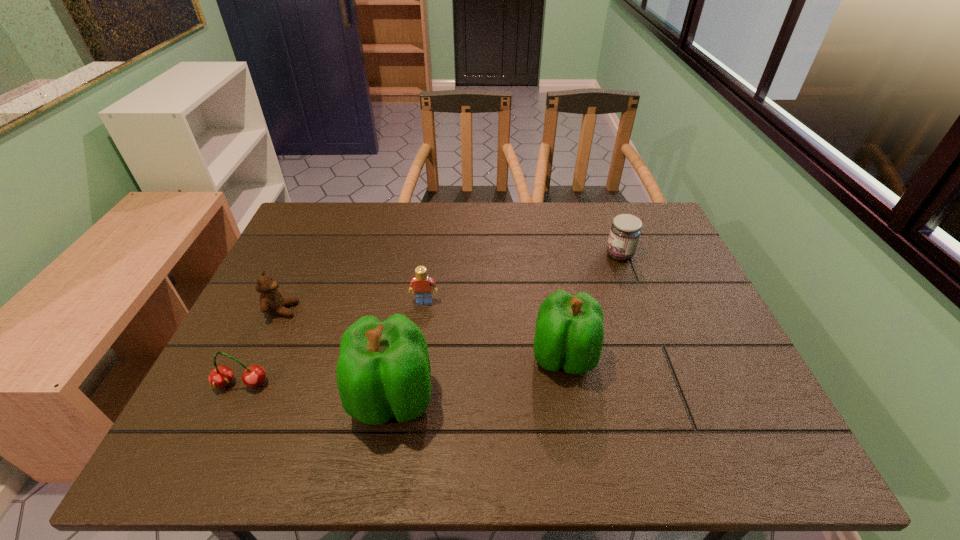
At what (x,y) coordinates should I click in order to perform the action: click on vacant space situated 0.170m on the right of the fifth shortest object. Please return your answer as a coordinate pair (x, y). This screenshot has width=960, height=540. Looking at the image, I should click on (669, 357).

I want to click on vacant area located 0.320m on the front label of the jam, so click(x=497, y=255).

Find the location of a particular element. vacant space located on the front label of the jam is located at coordinates (497, 255).

Where is `vacant space situated 0.220m on the front label of the jam`? Image resolution: width=960 pixels, height=540 pixels. vacant space situated 0.220m on the front label of the jam is located at coordinates coord(531,255).

You are a GUI agent. You are given a task and a screenshot of the screen. Output one action in this format:
    pyautogui.click(x=<x>, y=<y>)
    Task: Click on the vacant space located 0.180m at the face of the teddy bear
    
    Given the screenshot: What is the action you would take?
    pyautogui.click(x=367, y=310)

This screenshot has height=540, width=960. I want to click on vacant region located 0.250m on the front-facing side of the Lego, so (x=414, y=387).

This screenshot has height=540, width=960. What are the coordinates of `object present at the far edge` in the screenshot? It's located at (625, 231).

You are a GUI agent. You are given a task and a screenshot of the screen. Output one action in this format:
    pyautogui.click(x=<x>, y=<y>)
    Task: Click on the cherry that is at the near edge
    The width and height of the screenshot is (960, 540).
    Given the screenshot: What is the action you would take?
    pyautogui.click(x=220, y=377)

This screenshot has height=540, width=960. I want to click on teddy bear that is positioned at the left edge, so click(x=272, y=301).

At what (x,y) coordinates should I click in order to perform the action: click on cherry located at the left edge. Please return your answer as a coordinate pair (x, y). The image size is (960, 540). Looking at the image, I should click on (220, 377).